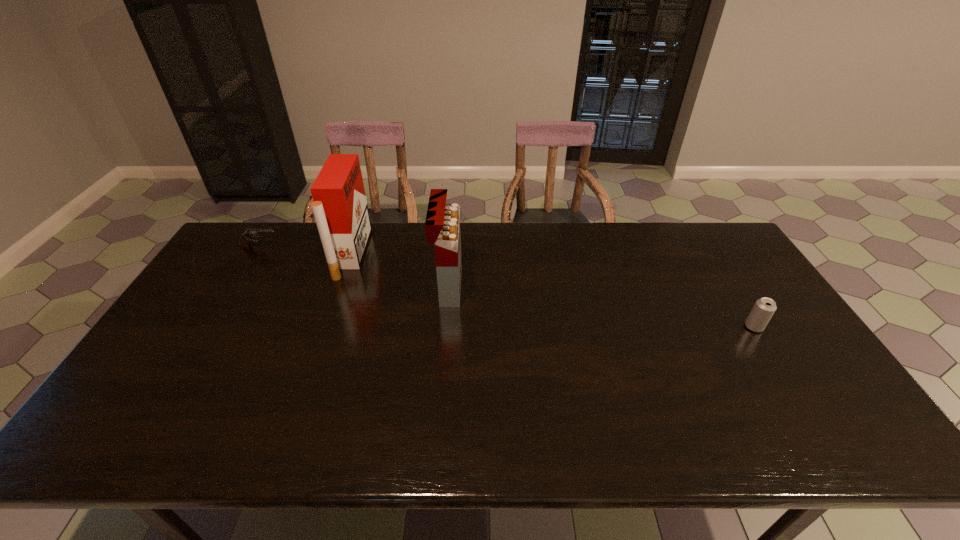
Find the location of a particular element. The image size is (960, 540). cigarette case that is at the far edge is located at coordinates click(x=340, y=208).

Locate an element on the screen. pistol located in the far edge section of the desktop is located at coordinates (247, 237).

You are a GUI agent. You are given a task and a screenshot of the screen. Output one action in this format:
    pyautogui.click(x=<x>, y=<y>)
    Task: Click on the object present at the left edge
    
    Given the screenshot: What is the action you would take?
    pyautogui.click(x=247, y=237)

Locate an element on the screen. object located at the right edge is located at coordinates (764, 308).

Find the location of `object located at the far left corner`. object located at the far left corner is located at coordinates (247, 237).

In the image, there is a desktop. Where is `vacant space at the far edge`? This screenshot has height=540, width=960. vacant space at the far edge is located at coordinates (574, 221).

You are a GUI agent. You are given a task and a screenshot of the screen. Output one action in this format:
    pyautogui.click(x=<x>, y=<y>)
    Task: Click on the free spot at the near edge of the desktop
    The height and width of the screenshot is (540, 960).
    Given the screenshot: What is the action you would take?
    pyautogui.click(x=581, y=438)

The width and height of the screenshot is (960, 540). What are the coordinates of `vacant area at the left edge` in the screenshot? It's located at (188, 333).

What are the coordinates of `free spot at the right edge of the desktop` in the screenshot? It's located at (799, 345).

This screenshot has height=540, width=960. In the image, there is a desktop. What are the coordinates of `vacant region at the far left corner` in the screenshot? It's located at click(x=253, y=256).